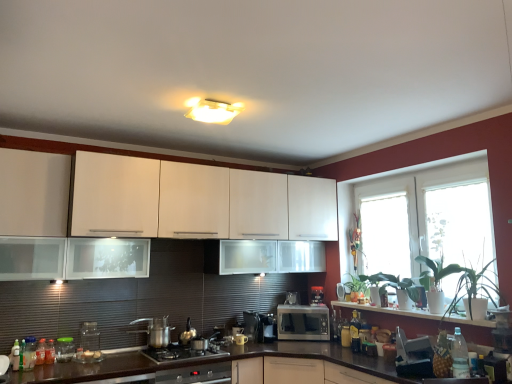
Question: Looking at the image, does metallic silver kettle at center, which is the 3th appliance in left-to-right order, seem bigger or smaller compared to translucent plastic bottle at lower right, positioned as the second bottle in left-to-right order?

Choices:
 (A) big
 (B) small

Answer: (A)

Question: From their relative heights in the image, would you say metallic silver kettle at center, marked as the fourth appliance in a right-to-left arrangement, is taller or shorter than translucent plastic bottle at lower right, marked as the 3th bottle in a front-to-back arrangement?

Choices:
 (A) tall
 (B) short

Answer: (B)

Question: Which of these objects is positioned closest to the stainless steel pot at lower center?

Choices:
 (A) matte glass mug at center, which is the 6th appliance from front to back
 (B) metallic silver kettle at center, which ranks as the fourth appliance in front-to-back order
 (C) stainless steel gas stove at center
 (D) metallic silver toaster at lower right, arranged as the 1th appliance when viewed from the front
 (E) green glossy plant at right, the 1th plant in the front-to-back sequence

Answer: (C)

Question: Which object is positioned closest to the transparent glass window at right, the first window screen from the front?

Choices:
 (A) green glossy plant at right, the 2th plant when ordered from back to front
 (B) green leafy plant at right, arranged as the third plant when viewed from the front
 (C) satin black coffee maker at center, the 5th appliance in the front-to-back sequence
 (D) matte glass mug at center, acting as the 2th appliance starting from the right
 (E) dark brown laminate countertop at lower center

Answer: (A)